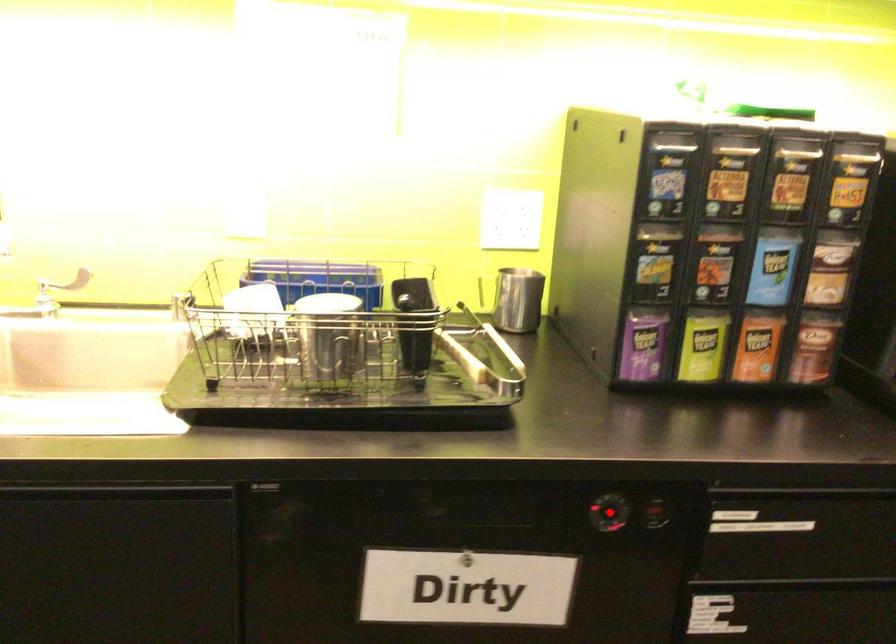
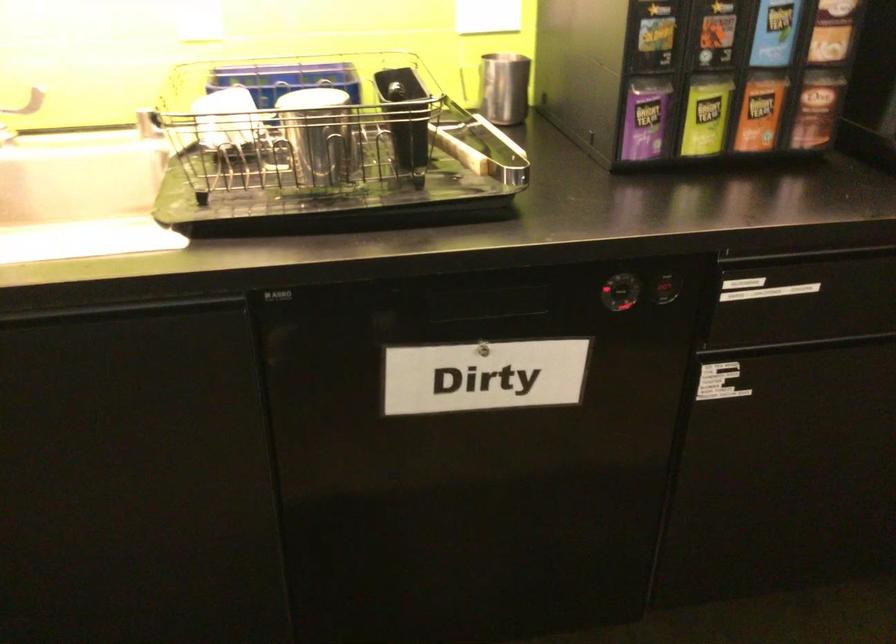
The point at the highlighted location is marked in the first image. Where is the corresponding point in the second image?

(623, 290)